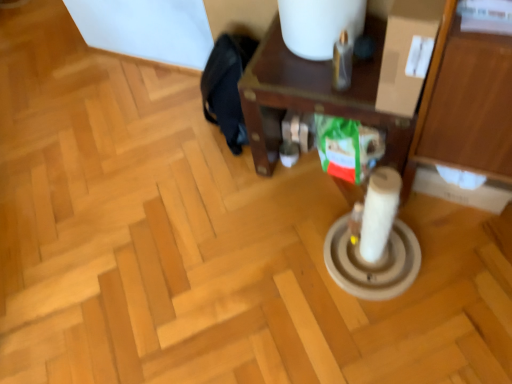
This screenshot has height=384, width=512. What do you see at coordinates (318, 98) in the screenshot?
I see `brown wooden side table at center` at bounding box center [318, 98].

This screenshot has height=384, width=512. What are the coordinates of `brown wooden side table at center` in the screenshot? It's located at (318, 98).

At what (x,y) coordinates should I click in order to perform the action: click on brown wooden side table at center. Please return your answer as a coordinate pair (x, y). This screenshot has height=384, width=512. Looking at the image, I should click on (318, 98).